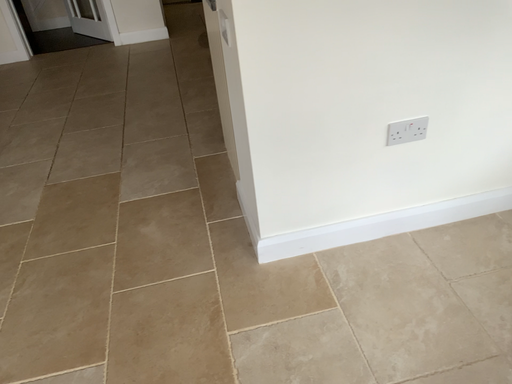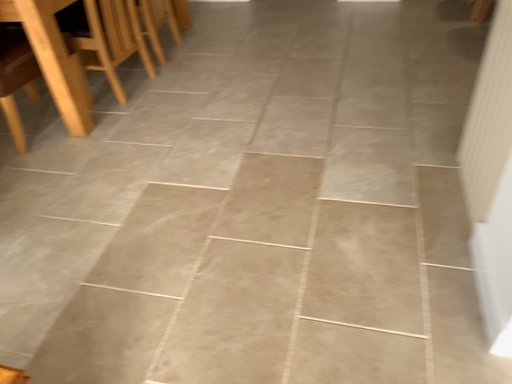
Question: How did the camera likely rotate when shooting the video?

Choices:
 (A) rotated right
 (B) rotated left

Answer: (B)